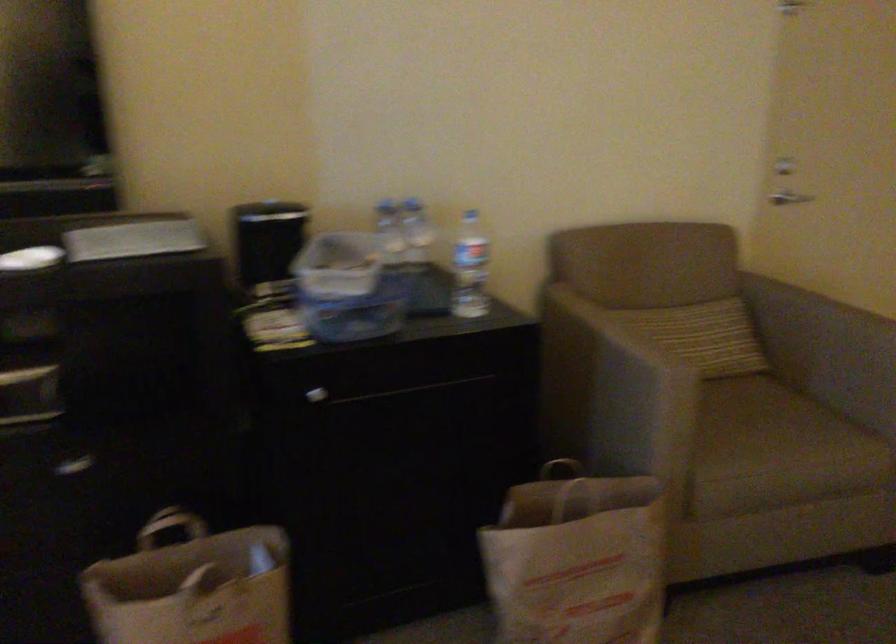
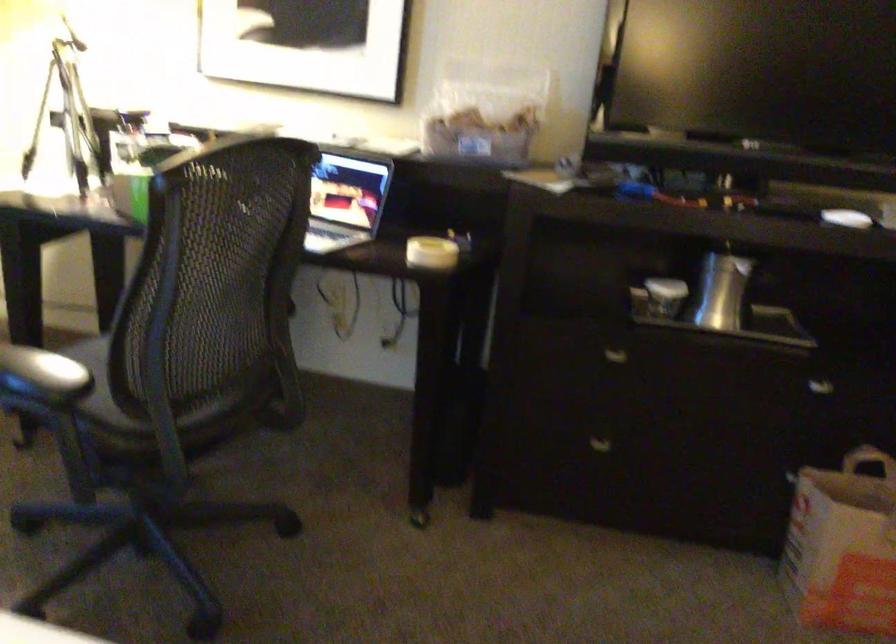
Find the pixel in the second image that matches point 80,471 in the first image.

(821, 389)